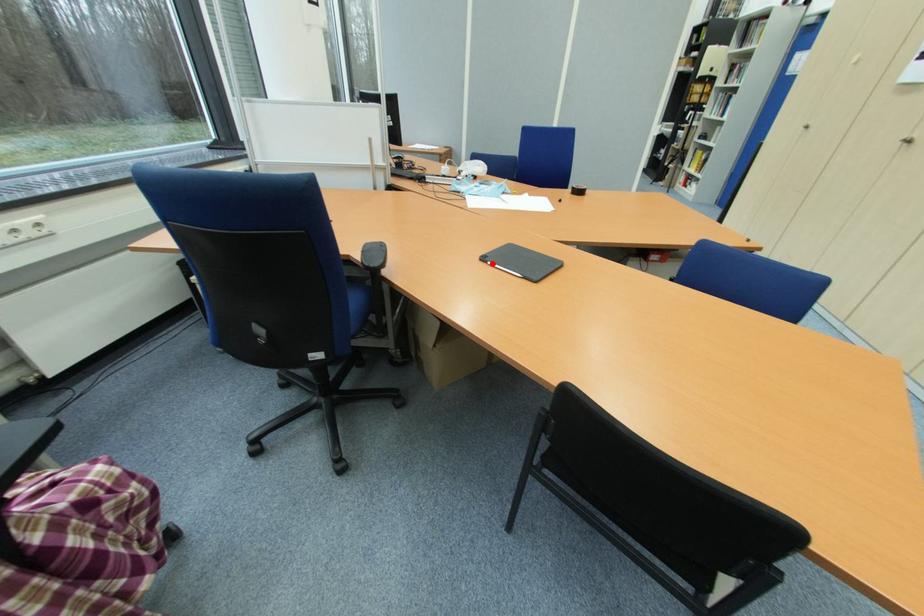
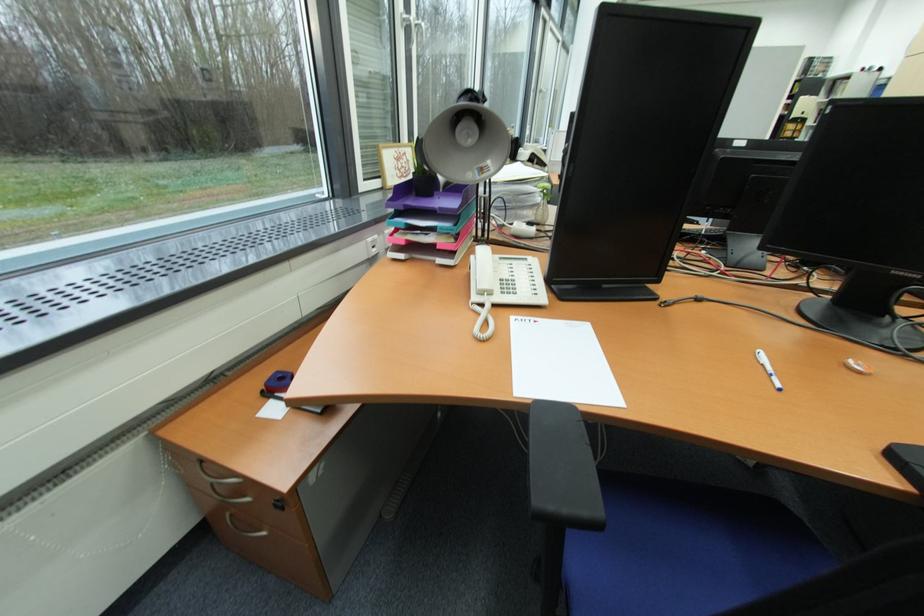
Question: I am providing you with two images of the same scene from different viewpoints. A red point is marked on the first image. Can you still see the location of the red point in image 2?

Choices:
 (A) Yes
 (B) No

Answer: (B)